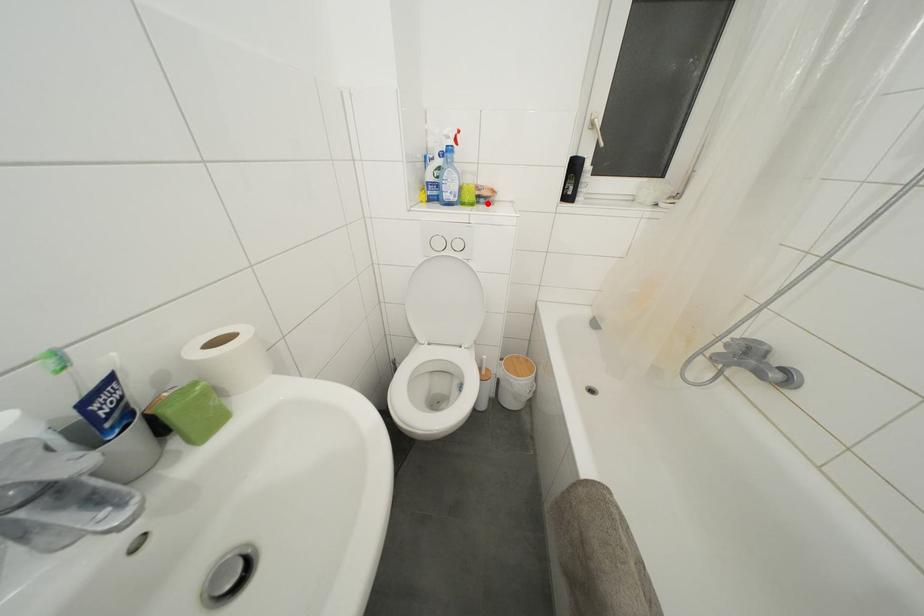
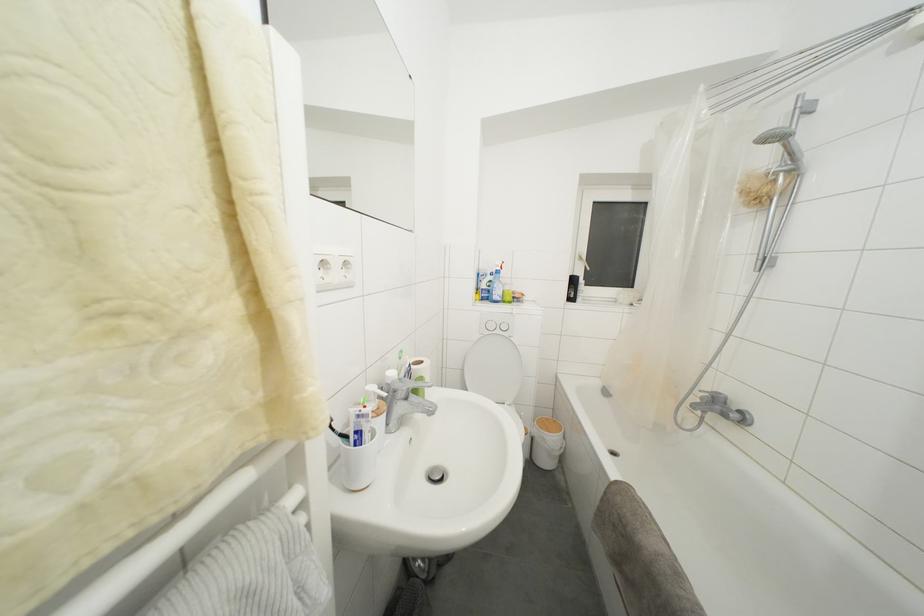
In the second image, find the point that corresponds to the highlighted location in the first image.

(520, 304)